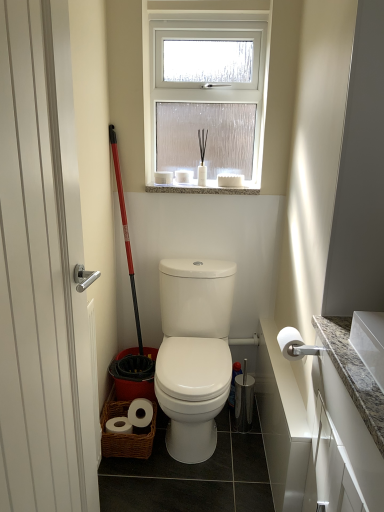
You are a GUI agent. You are given a task and a screenshot of the screen. Output one action in this format:
    pyautogui.click(x=<x>, y=<y>)
    Task: Click on the white granite countertop at right
    This screenshot has width=384, height=512.
    Given the screenshot: What is the action you would take?
    pyautogui.click(x=353, y=374)

What is the approximate width of white matte toilet paper at right?

white matte toilet paper at right is 5.15 inches wide.

Measure the distance between white glossy door at left and camera.

white glossy door at left and camera are 72.70 centimeters apart from each other.

Image resolution: width=384 pixels, height=512 pixels. What do you see at coordinates (40, 270) in the screenshot? I see `white glossy door at left` at bounding box center [40, 270].

The image size is (384, 512). Identify the location of white glossy toilet at center. (194, 353).

Looking at this image, visually, is granite at upper center positioned to the left or to the right of white granite countertop at right?

From the image, it's evident that granite at upper center is to the left of white granite countertop at right.

This screenshot has width=384, height=512. In order to click on window sill lying on the left of white granite countertop at right in this screenshot , I will do `click(203, 188)`.

How different are the orientations of granite at upper center and white granite countertop at right in degrees?

89.9 degrees separate the facing orientations of granite at upper center and white granite countertop at right.

Is white glossy door at left facing away from white frosted glass window at upper center?

No, white glossy door at left's orientation is not away from white frosted glass window at upper center.

Considering the relative sizes of white glossy door at left and white frosted glass window at upper center in the image provided, is white glossy door at left smaller than white frosted glass window at upper center?

Incorrect, white glossy door at left is not smaller in size than white frosted glass window at upper center.

In the scene shown: Between white glossy door at left and white frosted glass window at upper center, which one has smaller width?

Thinner between the two is white glossy door at left.

Between point (29, 283) and point (184, 25), which one is positioned behind?

The point (184, 25) is farther.

Locate an element on the screen. The image size is (384, 512). window sill that appears on the left of white matte toilet paper at right is located at coordinates (203, 188).

From a real-world perspective, does white matte toilet paper at right sit lower than granite at upper center?

Yes, from a real-world perspective, white matte toilet paper at right is under granite at upper center.

Is white matte toilet paper at right behind granite at upper center?

No, white matte toilet paper at right is closer to the viewer.

Which point is more distant from viewer, (220, 76) or (235, 188)?

The point (220, 76) is farther from the camera.

Where is `window on the right of granite at upper center`? Image resolution: width=384 pixels, height=512 pixels. window on the right of granite at upper center is located at coordinates (206, 98).

From a real-world perspective, is white frosted glass window at upper center on granite at upper center?

Yes.

Considering the sizes of objects white granite countertop at right and white glossy door at left in the image provided, who is bigger, white granite countertop at right or white glossy door at left?

white granite countertop at right.

Is white granite countertop at right oriented away from white glossy door at left?

white granite countertop at right does not have its back to white glossy door at left.

Which object is positioned more to the left, white granite countertop at right or white glossy door at left?

From the viewer's perspective, white glossy door at left appears more on the left side.

Based on the photo, from the image's perspective, which object appears higher, white glossy toilet at center or granite at upper center?

granite at upper center, from the image's perspective.

Is point (177, 441) less distant than point (209, 183)?

Yes, it is.

Considering the sizes of objects white glossy toilet at center and granite at upper center in the image provided, who is thinner, white glossy toilet at center or granite at upper center?

With smaller width is granite at upper center.

Would you say white matte toilet paper at right is a long distance from white frosted glass window at upper center?

Yes, white matte toilet paper at right is far from white frosted glass window at upper center.

Does point (291, 351) come behind point (224, 104)?

No.

In terms of width, does white matte toilet paper at right look wider or thinner when compared to white frosted glass window at upper center?

In the image, white matte toilet paper at right appears to be wider than white frosted glass window at upper center.

Considering the relative positions of white matte toilet paper at right and white frosted glass window at upper center in the image provided, is white matte toilet paper at right behind white frosted glass window at upper center?

That is False.

Where is `window sill behind the white granite countertop at right`? This screenshot has height=512, width=384. window sill behind the white granite countertop at right is located at coordinates (203, 188).

I want to click on window above the white glossy door at left (from the image's perspective), so click(x=206, y=98).

Based on the photo, when comparing their distances from white glossy toilet at center, does white glossy door at left or granite at upper center seem further?

Based on the image, white glossy door at left appears to be further to white glossy toilet at center.

Based on their spatial positions, is white glossy door at left or white matte toilet paper at right closer to white glossy toilet at center?

Among the two, white matte toilet paper at right is located nearer to white glossy toilet at center.

Based on the photo, considering their positions, is red plastic ski pole at left positioned further to granite at upper center than white matte toilet paper at right?

white matte toilet paper at right.

Considering their positions, is red plastic ski pole at left positioned closer to granite at upper center than white granite countertop at right?

The object closer to granite at upper center is red plastic ski pole at left.

Which object lies further to the anchor point white matte toilet paper at right, white glossy toilet at center or white glossy door at left?

white glossy door at left.

Based on the photo, when comparing their distances from white frosted glass window at upper center, does white glossy door at left or white glossy toilet at center seem closer?

white glossy toilet at center.

Which object lies further to the anchor point red plastic ski pole at left, white granite countertop at right or white matte toilet paper at right?

white granite countertop at right is positioned further to the anchor red plastic ski pole at left.

Based on their spatial positions, is white glossy toilet at center or white frosted glass window at upper center closer to red plastic ski pole at left?

white glossy toilet at center lies closer to red plastic ski pole at left than the other object.

What are the coordinates of `ski pole located between white glossy door at left and white frosted glass window at upper center in the depth direction` in the screenshot? It's located at (125, 231).

The height and width of the screenshot is (512, 384). Find the location of `window sill between white frosted glass window at upper center and white granite countertop at right vertically`. window sill between white frosted glass window at upper center and white granite countertop at right vertically is located at coordinates (203, 188).

Find the location of `toilet paper between white glossy door at left and white frosted glass window at upper center along the z-axis`. toilet paper between white glossy door at left and white frosted glass window at upper center along the z-axis is located at coordinates (290, 343).

At what (x,y) coordinates should I click in order to perform the action: click on counter top between white glossy door at left and granite at upper center along the z-axis. Please return your answer as a coordinate pair (x, y). Looking at the image, I should click on (353, 374).